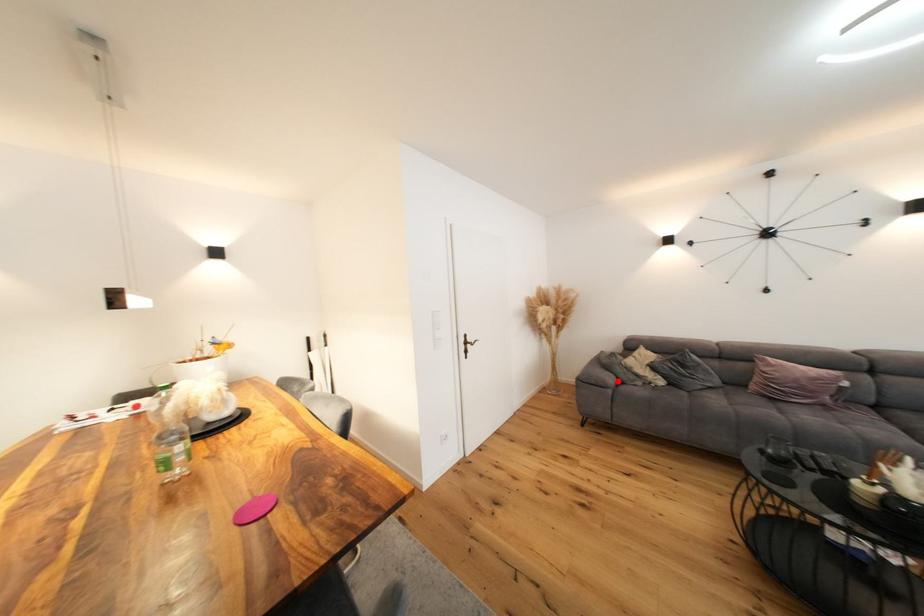
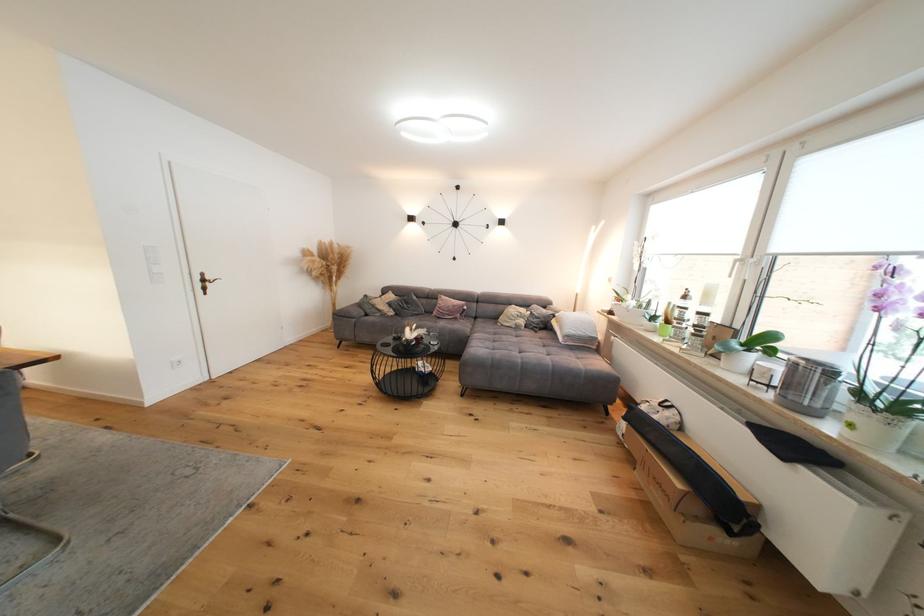
Locate, in the second image, the point that corresponds to the highlighted location in the first image.

(365, 314)